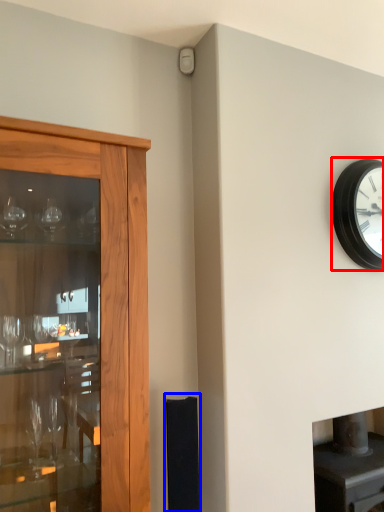
Question: Which point is closer to the camera, wall clock (highlighted by a red box) or speaker (highlighted by a blue box)?

Choices:
 (A) wall clock
 (B) speaker

Answer: (B)